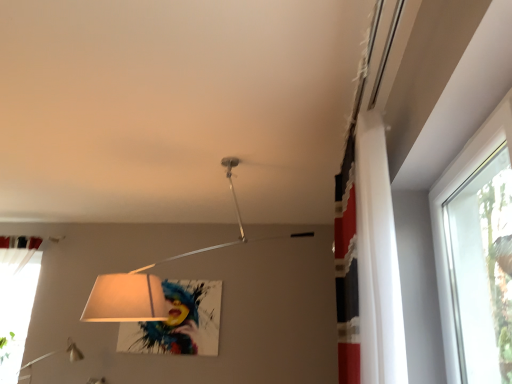
Question: Considering the relative positions of white fabric curtain at upper right, which appears as the second curtain when viewed from the left, and matte white lampshade at center in the image provided, is white fabric curtain at upper right, which appears as the second curtain when viewed from the left, behind matte white lampshade at center?

Choices:
 (A) yes
 (B) no

Answer: (B)

Question: Is white fabric curtain at upper right, which appears as the second curtain when viewed from the left, not inside matte white lampshade at center?

Choices:
 (A) yes
 (B) no

Answer: (A)

Question: Are white fabric curtain at upper right, placed as the second curtain when sorted from back to front, and matte white lampshade at center beside each other?

Choices:
 (A) yes
 (B) no

Answer: (B)

Question: Is matte white lampshade at center surrounded by white fabric curtain at upper right, placed as the second curtain when sorted from back to front?

Choices:
 (A) no
 (B) yes

Answer: (A)

Question: Considering the relative sizes of white fabric curtain at upper right, the first curtain when ordered from right to left, and matte white lampshade at center in the image provided, is white fabric curtain at upper right, the first curtain when ordered from right to left, bigger than matte white lampshade at center?

Choices:
 (A) no
 (B) yes

Answer: (A)

Question: From the image's perspective, is transparent glass window at upper right located above or below white fabric curtain at upper right, which appears as the second curtain when viewed from the left?

Choices:
 (A) above
 (B) below

Answer: (B)

Question: From their relative heights in the image, would you say transparent glass window at upper right is taller or shorter than white fabric curtain at upper right, which appears as the second curtain when viewed from the left?

Choices:
 (A) tall
 (B) short

Answer: (B)

Question: Is point (435, 188) positioned closer to the camera than point (361, 268)?

Choices:
 (A) farther
 (B) closer

Answer: (A)

Question: Is transparent glass window at upper right to the left or to the right of white fabric curtain at upper right, arranged as the 1th curtain when viewed from the front, in the image?

Choices:
 (A) right
 (B) left

Answer: (A)

Question: Is white sheer curtain at lower left, the first curtain viewed from the back, wider or thinner than transparent glass window at upper right?

Choices:
 (A) wide
 (B) thin

Answer: (A)

Question: Is white sheer curtain at lower left, the first curtain in the left-to-right sequence, taller or shorter than transparent glass window at upper right?

Choices:
 (A) short
 (B) tall

Answer: (B)

Question: Considering the relative positions of white sheer curtain at lower left, the 2th curtain viewed from the front, and transparent glass window at upper right in the image provided, is white sheer curtain at lower left, the 2th curtain viewed from the front, to the left or to the right of transparent glass window at upper right?

Choices:
 (A) left
 (B) right

Answer: (A)

Question: Considering the positions of point (34, 258) and point (477, 139), is point (34, 258) closer or farther from the camera than point (477, 139)?

Choices:
 (A) farther
 (B) closer

Answer: (A)

Question: From the image's perspective, is matte white lampshade at center located above or below transparent glass window at upper right?

Choices:
 (A) above
 (B) below

Answer: (A)

Question: Considering the positions of point (238, 221) and point (502, 134), is point (238, 221) closer or farther from the camera than point (502, 134)?

Choices:
 (A) closer
 (B) farther

Answer: (B)